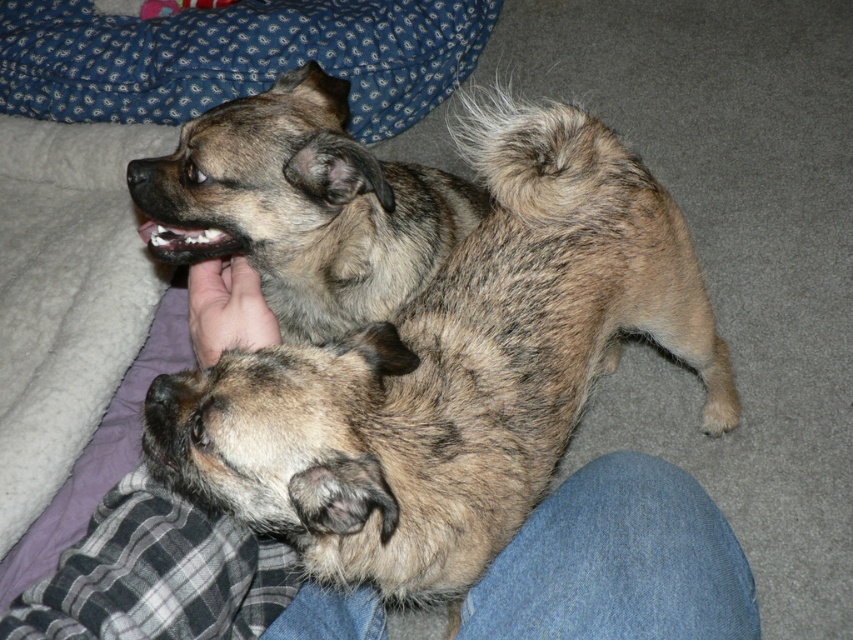
Question: Can you confirm if brown speckled fur dog at center is smaller than soft skin hand at center?

Choices:
 (A) yes
 (B) no

Answer: (B)

Question: Can you confirm if brown speckled fur dog at center is positioned above soft skin hand at center?

Choices:
 (A) yes
 (B) no

Answer: (B)

Question: Which object appears closest to the camera in this image?

Choices:
 (A) soft skin hand at center
 (B) brown speckled fur dog at center

Answer: (B)

Question: Among these objects, which one is nearest to the camera?

Choices:
 (A) brown speckled fur dog at center
 (B) soft skin hand at center

Answer: (A)

Question: Among these points, which one is farthest from the camera?

Choices:
 (A) (225, 307)
 (B) (422, 196)

Answer: (B)

Question: Is brown speckled fur dog at center smaller than soft skin hand at center?

Choices:
 (A) no
 (B) yes

Answer: (A)